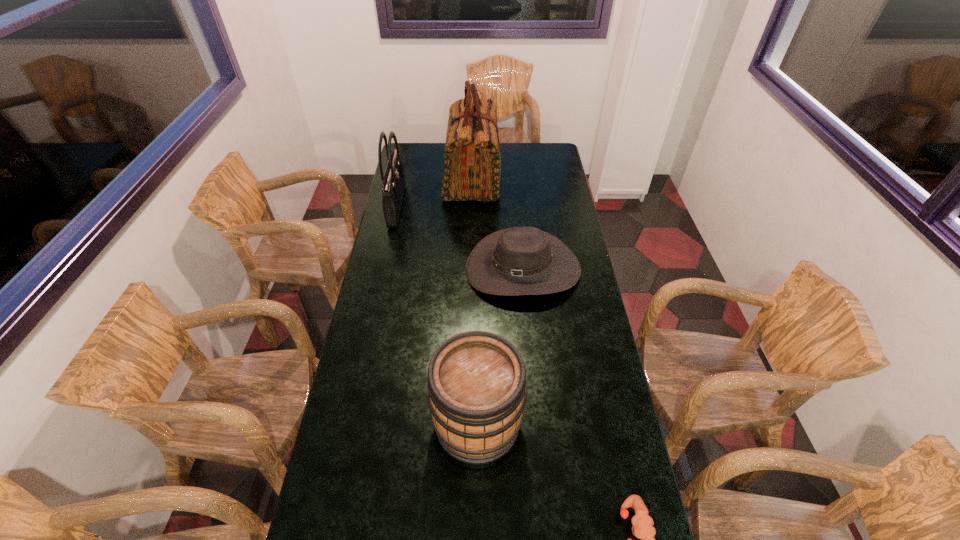
Choose which object is the nearest neighbor to the third nearest object. Please provide its 2D coordinates. Your answer should be formatted as a tuple, i.e. [(x, y)], where the tuple contains the x and y coordinates of a point satisfying the conditions above.

[(472, 164)]

Locate an element on the screen. The height and width of the screenshot is (540, 960). free space in the image that satisfies the following two spatial constraints: 1. on the open handle side of the fourth farthest object; 2. on the right side of the shopping bag is located at coordinates (468, 423).

The height and width of the screenshot is (540, 960). In order to click on free region that satisfies the following two spatial constraints: 1. on the open handle side of the tallest object; 2. on the right side of the cider in this screenshot , I will do `click(468, 423)`.